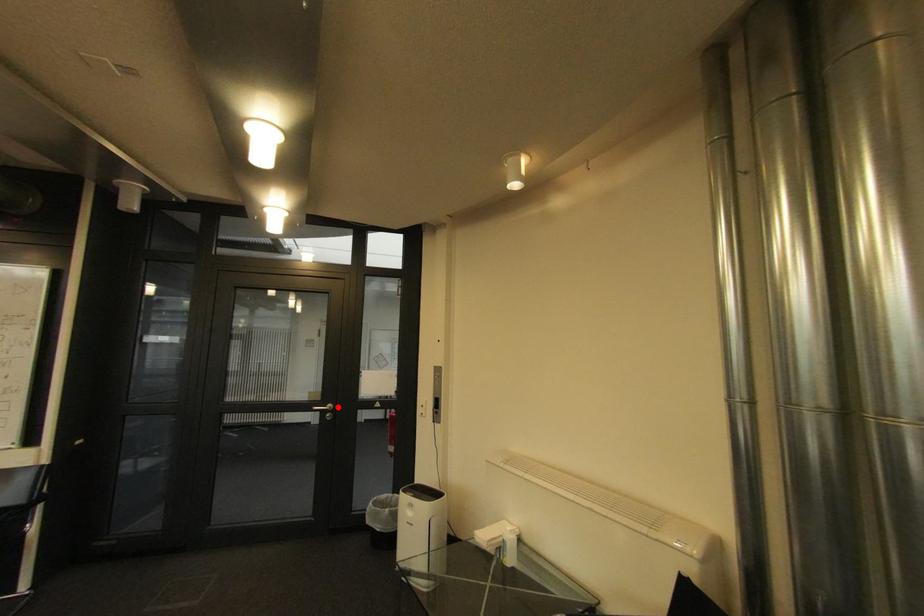
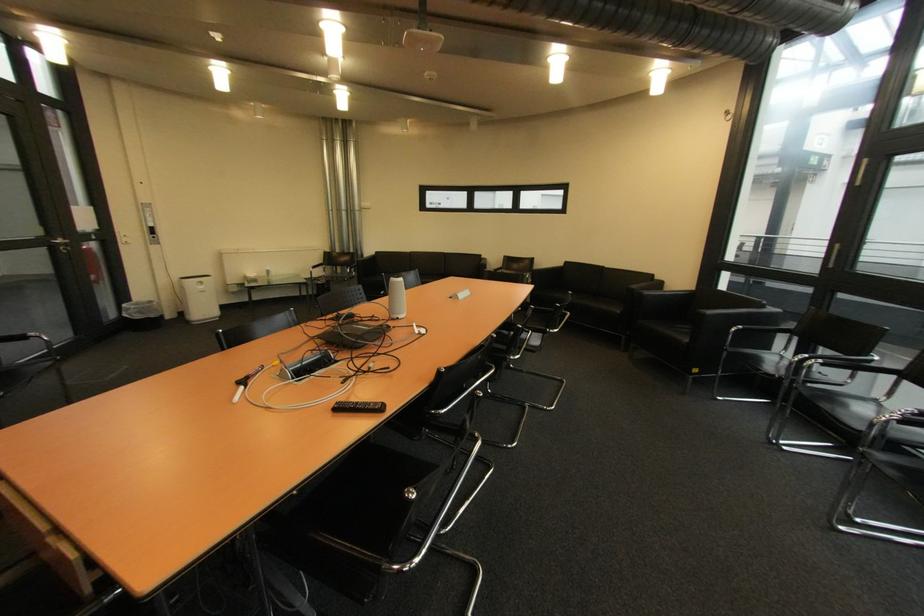
Find the pixel in the second image that matches the highlighted location in the first image.

(68, 241)